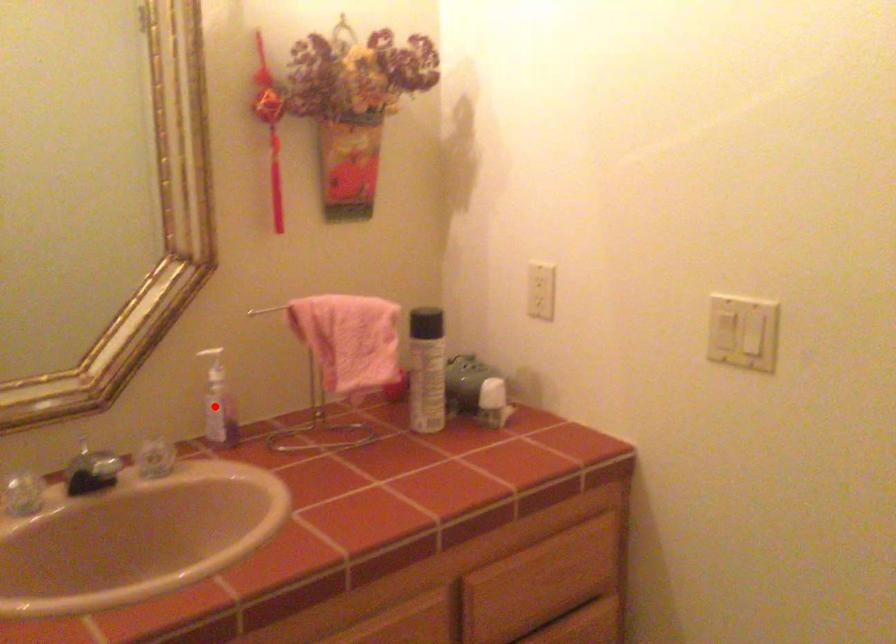
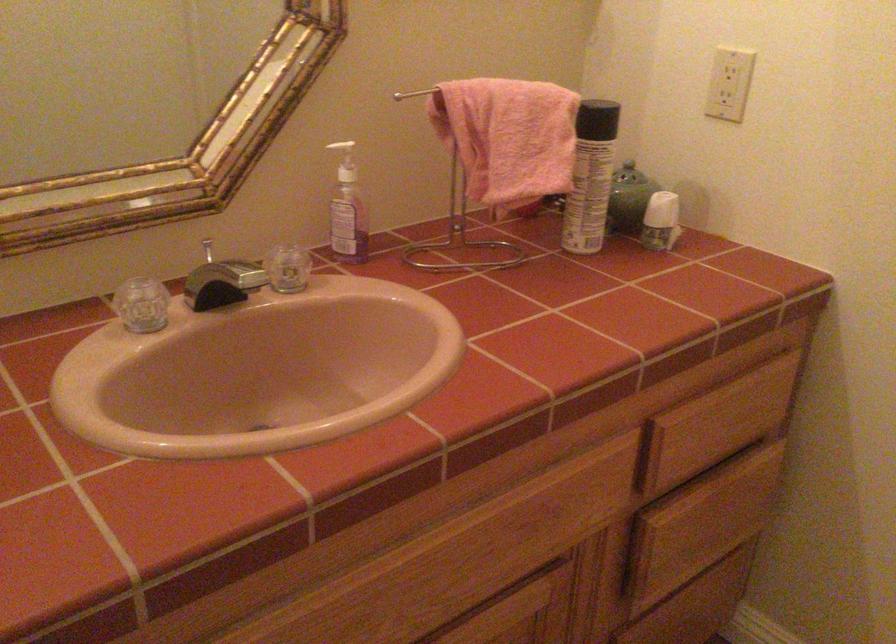
In the second image, find the point that corresponds to the highlighted location in the first image.

(348, 210)